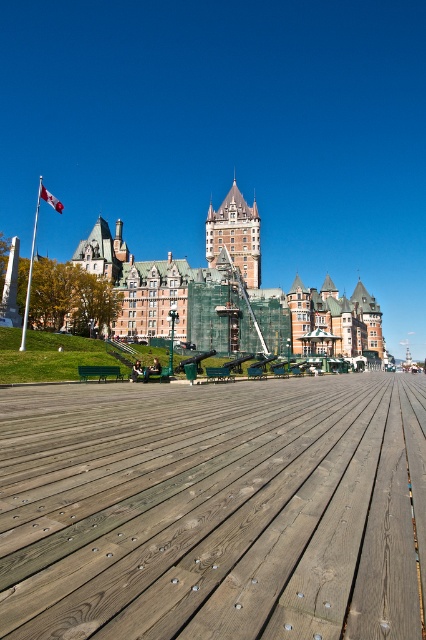
Can you confirm if wooden at center is positioned to the left of white fabric flag at upper left?

Incorrect, wooden at center is not on the left side of white fabric flag at upper left.

Identify the location of wooden at center. 213,509.

Image resolution: width=426 pixels, height=640 pixels. I want to click on wooden at center, so click(213, 509).

Where is `wooden at center`? wooden at center is located at coordinates (213, 509).

Based on the photo, who is taller, wooden at center or orange brick building at center?

Standing taller between the two is orange brick building at center.

Is wooden at center positioned before orange brick building at center?

Yes, wooden at center is closer to the viewer.

Who is more distant from viewer, (120, 470) or (235, 182)?

Positioned behind is point (235, 182).

This screenshot has width=426, height=640. Identify the location of wooden at center. (213, 509).

Is point (259, 342) farther from camera compared to point (48, 202)?

No, it is not.

Between orange brick building at center and white fabric flag at upper left, which one is positioned lower?

orange brick building at center

Which is behind, point (249, 317) or point (40, 193)?

The point (40, 193) is behind.

The width and height of the screenshot is (426, 640). I want to click on orange brick building at center, so click(x=229, y=296).